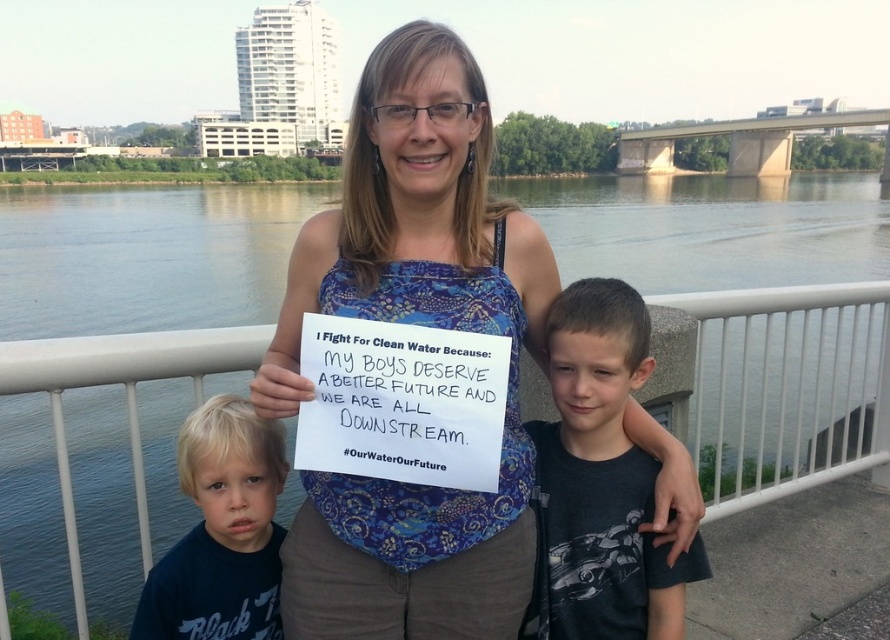
Who is taller, blue patterned tank top at center or dark blue t-shirt at lower left?

Standing taller between the two is blue patterned tank top at center.

Is point (474, 534) closer to camera compared to point (168, 579)?

That is True.

Locate an element on the screen. blue patterned tank top at center is located at coordinates (418, 323).

Identify the location of blue patterned tank top at center. This screenshot has height=640, width=890. (418, 323).

Between green water at center and blue patterned tank top at center, which one appears on the left side from the viewer's perspective?

From the viewer's perspective, green water at center appears more on the left side.

Is green water at center to the left of blue patterned tank top at center from the viewer's perspective?

Indeed, green water at center is positioned on the left side of blue patterned tank top at center.

Which is behind, point (777, 433) or point (409, 515)?

The point (777, 433) is behind.

Image resolution: width=890 pixels, height=640 pixels. What are the coordinates of `green water at center` in the screenshot? It's located at (120, 365).

Is blue patterned tank top at center above dark gray t-shirt at right?

Yes.

Image resolution: width=890 pixels, height=640 pixels. What do you see at coordinates (418, 323) in the screenshot?
I see `blue patterned tank top at center` at bounding box center [418, 323].

You are a GUI agent. You are given a task and a screenshot of the screen. Output one action in this format:
    pyautogui.click(x=<x>, y=<y>)
    Task: Click on the blue patterned tank top at center
    
    Given the screenshot: What is the action you would take?
    pyautogui.click(x=418, y=323)